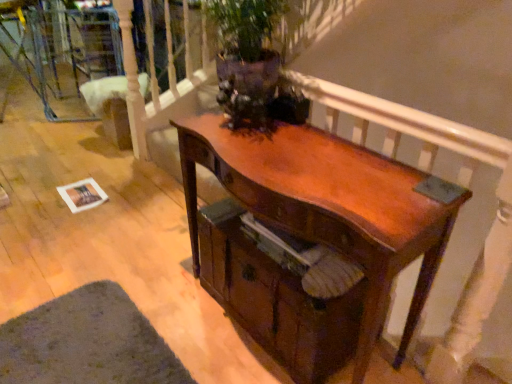
In order to face shiny brown wood desk at center, should I rotate leftwards or rightwards?

Turn right by 4.421 degrees to look at shiny brown wood desk at center.

Describe the element at coordinates (311, 238) in the screenshot. I see `shiny brown wood desk at center` at that location.

What do you see at coordinates (282, 291) in the screenshot?
I see `shiny brown drawer at center` at bounding box center [282, 291].

What is the approximate width of green felt mat at lower left?

The width of green felt mat at lower left is 20.46 inches.

Find the location of a particular element. This screenshot has width=512, height=384. shiny brown wood desk at center is located at coordinates (311, 238).

Is shiny brown wood desk at center situated inside shiny brown drawer at center or outside?

shiny brown wood desk at center is enclosed within shiny brown drawer at center.

Which object is thinner, shiny brown wood desk at center or shiny brown drawer at center?

shiny brown wood desk at center.

Does shiny brown wood desk at center touch shiny brown drawer at center?

Yes, shiny brown wood desk at center is touching shiny brown drawer at center.

Is shiny brown wood desk at center looking in the opposite direction of shiny brown drawer at center?

Yes, shiny brown wood desk at center's orientation is away from shiny brown drawer at center.

From the image's perspective, relative to wooden armchair at center, is shiny brown wood desk at center above or below?

shiny brown wood desk at center is below wooden armchair at center.

Can you confirm if shiny brown wood desk at center is positioned to the right of wooden armchair at center?

Yes.

Between shiny brown wood desk at center and wooden armchair at center, which one has smaller size?

Smaller between the two is wooden armchair at center.

Consider the image. Choose the correct answer: Is green felt mat at lower left inside shiny brown wood desk at center or outside it?

green felt mat at lower left is located beyond the bounds of shiny brown wood desk at center.

Is green felt mat at lower left thinner than shiny brown wood desk at center?

No, green felt mat at lower left is not thinner than shiny brown wood desk at center.

Can you see green felt mat at lower left touching shiny brown wood desk at center?

No, green felt mat at lower left is not next to shiny brown wood desk at center.

In the image, is green felt mat at lower left positioned in front of or behind shiny brown wood desk at center?

green felt mat at lower left is behind shiny brown wood desk at center.

Is green felt mat at lower left aimed at wooden armchair at center?

No, green felt mat at lower left is not turned towards wooden armchair at center.

Which is in front, green felt mat at lower left or wooden armchair at center?

Positioned in front is green felt mat at lower left.

From the image's perspective, is green felt mat at lower left positioned above or below wooden armchair at center?

Clearly, from the image's perspective, green felt mat at lower left is below wooden armchair at center.

Does wooden armchair at center have a lesser height compared to shiny brown wood desk at center?

Yes.

Does wooden armchair at center have a lesser width compared to shiny brown wood desk at center?

Yes, wooden armchair at center is thinner than shiny brown wood desk at center.

Consider the image. Is wooden armchair at center turned away from shiny brown wood desk at center?

No.

From a real-world perspective, who is located higher, green felt mat at lower left or shiny brown drawer at center?

In real-world perspective, shiny brown drawer at center is above.

This screenshot has width=512, height=384. Identify the location of drawer above the green felt mat at lower left (from the image's perspective). (282, 291).

Which of these two, green felt mat at lower left or shiny brown drawer at center, is thinner?

shiny brown drawer at center.

Can shiny brown drawer at center be found inside green felt mat at lower left?

No, shiny brown drawer at center is not surrounded by green felt mat at lower left.

Is shiny brown wood desk at center far away from green felt mat at lower left?

Actually, shiny brown wood desk at center and green felt mat at lower left are a little close together.

Considering the sizes of objects shiny brown wood desk at center and green felt mat at lower left in the image provided, who is taller, shiny brown wood desk at center or green felt mat at lower left?

shiny brown wood desk at center.

Image resolution: width=512 pixels, height=384 pixels. Find the location of `mat on the left of shiny brown wood desk at center`. mat on the left of shiny brown wood desk at center is located at coordinates (87, 342).

Where is `desk located above the shiny brown drawer at center (from the image's perspective)`? desk located above the shiny brown drawer at center (from the image's perspective) is located at coordinates (311, 238).

In order to click on desk that appears on the right of wooden armchair at center in this screenshot , I will do `click(311, 238)`.

From the image, which object appears to be farther from shiny brown wood desk at center, wooden armchair at center or shiny brown drawer at center?

Among the two, wooden armchair at center is located further to shiny brown wood desk at center.

Considering their positions, is shiny brown drawer at center positioned closer to wooden armchair at center than shiny brown wood desk at center?

shiny brown drawer at center.

Considering their positions, is green felt mat at lower left positioned closer to shiny brown wood desk at center than wooden armchair at center?

green felt mat at lower left is positioned closer to the anchor shiny brown wood desk at center.

From the picture: Looking at the image, which one is located further to shiny brown wood desk at center, shiny brown drawer at center or green felt mat at lower left?

green felt mat at lower left lies further to shiny brown wood desk at center than the other object.

Considering their positions, is green felt mat at lower left positioned further to shiny brown drawer at center than wooden armchair at center?

wooden armchair at center lies further to shiny brown drawer at center than the other object.

Estimate the real-world distances between objects in this image. Which object is closer to wooden armchair at center, shiny brown drawer at center or green felt mat at lower left?

green felt mat at lower left lies closer to wooden armchair at center than the other object.

Looking at the image, which one is located further to wooden armchair at center, green felt mat at lower left or shiny brown wood desk at center?

shiny brown wood desk at center is positioned further to the anchor wooden armchair at center.

When comparing their distances from shiny brown wood desk at center, does wooden armchair at center or green felt mat at lower left seem closer?

green felt mat at lower left is positioned closer to the anchor shiny brown wood desk at center.

Identify the location of desk between green felt mat at lower left and shiny brown drawer at center in the horizontal direction. (311, 238).

Where is `drawer located between shiny brown wood desk at center and wooden armchair at center in the depth direction`? drawer located between shiny brown wood desk at center and wooden armchair at center in the depth direction is located at coordinates (282, 291).

I want to click on mat between shiny brown wood desk at center and wooden armchair at center along the z-axis, so click(x=87, y=342).

At what (x,y) coordinates should I click in order to perform the action: click on drawer positioned between green felt mat at lower left and wooden armchair at center from near to far. Please return your answer as a coordinate pair (x, y). The image size is (512, 384). Looking at the image, I should click on (282, 291).